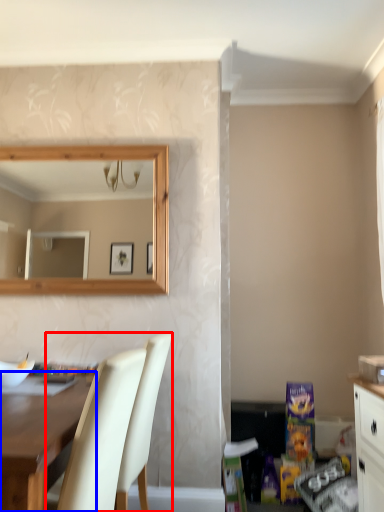
Question: Which object is closer to the camera taking this photo, chair (highlighted by a red box) or desk (highlighted by a blue box)?

Choices:
 (A) chair
 (B) desk

Answer: (B)